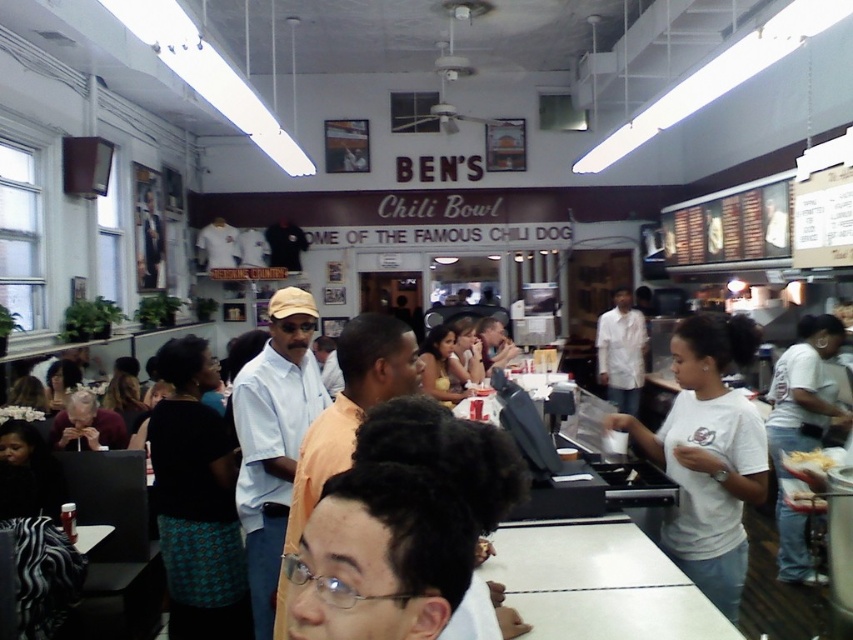
You are a customer at Ben Chili Bowl and you see the matte white shirt at center and the white paper bag at center. Which object is closer to you?

The matte white shirt at center is closer to you because it is in front of the white paper bag at center.

You are a customer at Ben Chili Bowl and you want to order a chili dog. There are two staff members at the counter. One is wearing a black textured skirt at center and the other is wearing a matte white shirt at center. Which staff member should you approach to place your order?

You should approach the matte white shirt at center because the black textured skirt at center is to the left of matte white shirt at center, so the staff member in the matte white shirt at center is likely the one handling orders at the counter.